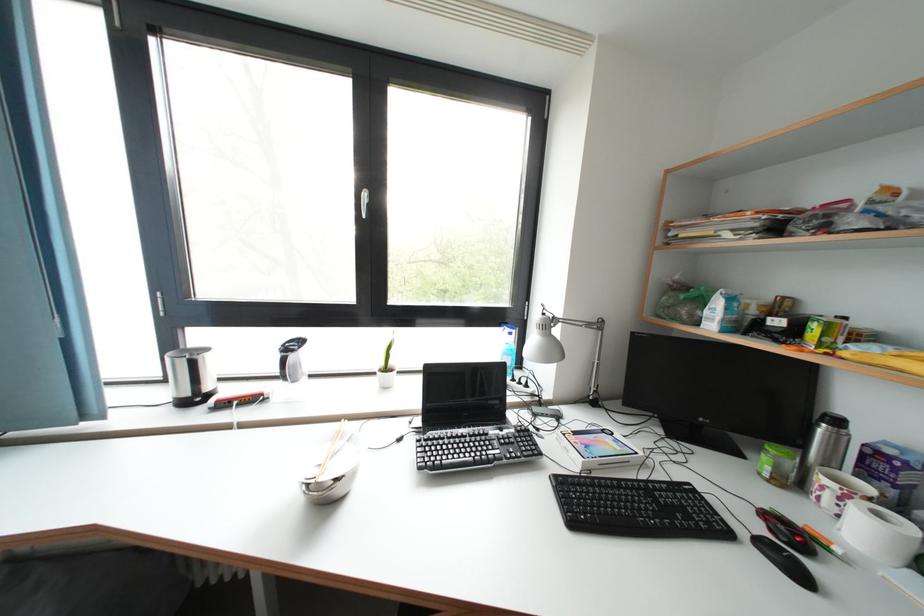
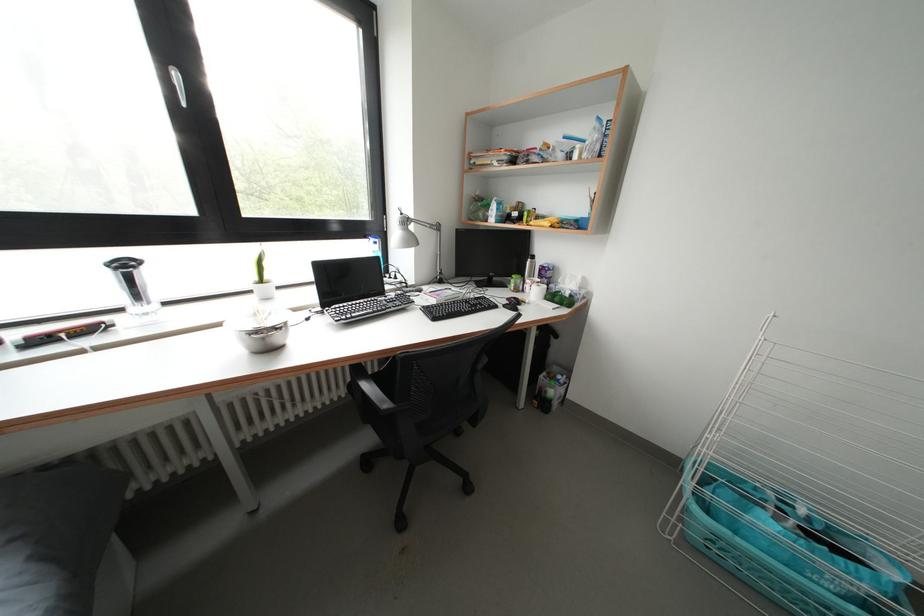
Where in the second image is the point corresponding to the point at 551,318 from the first image?

(408, 219)